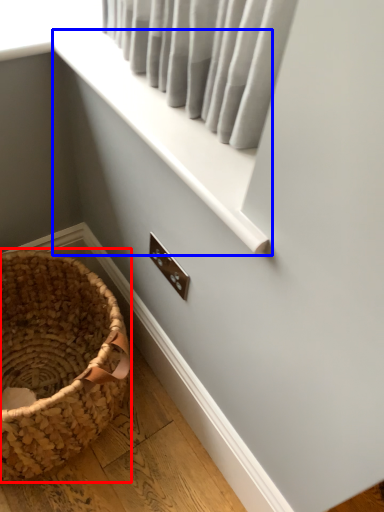
Question: Which object appears farthest to the camera in this image, picnic basket (highlighted by a red box) or window frame (highlighted by a blue box)?

Choices:
 (A) picnic basket
 (B) window frame

Answer: (A)